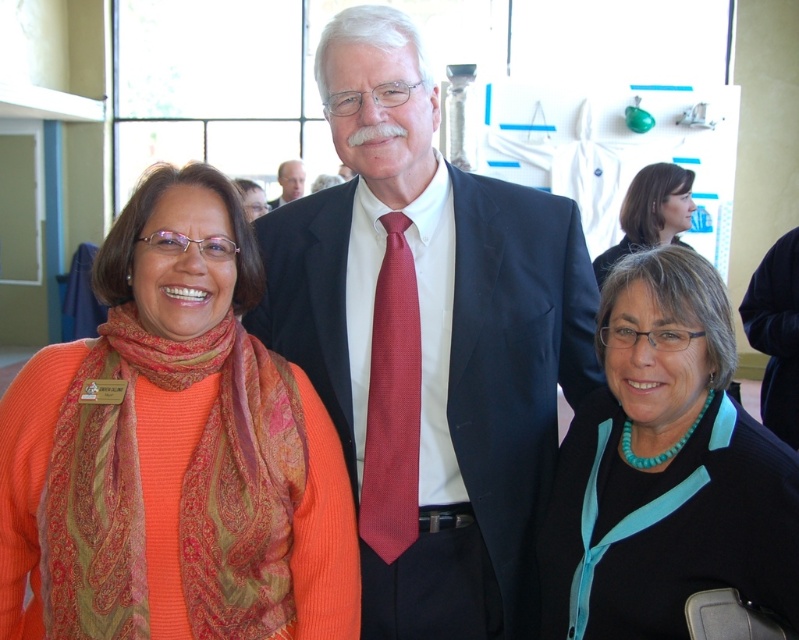
Who is taller, red textured tie at center or teal fabric blouse at upper right?

Standing taller between the two is red textured tie at center.

From the picture: Does red textured tie at center appear over teal fabric blouse at upper right?

No, red textured tie at center is not above teal fabric blouse at upper right.

Does point (374, 301) come closer to viewer compared to point (619, 225)?

Yes.

Identify the location of red textured tie at center. (392, 403).

Does matte black suit at center have a greater width compared to red textured tie at center?

Yes, matte black suit at center is wider than red textured tie at center.

How much distance is there between matte black suit at center and red textured tie at center?

matte black suit at center is 7.41 inches away from red textured tie at center.

Which is in front, point (471, 339) or point (416, 460)?

Point (416, 460) is more forward.

This screenshot has height=640, width=799. What are the coordinates of `matte black suit at center` in the screenshot? It's located at (428, 340).

Between matte black suit at center and paisley-patterned scarf at left, which one appears on the left side from the viewer's perspective?

paisley-patterned scarf at left is more to the left.

Between matte black suit at center and paisley-patterned scarf at left, which one appears on the right side from the viewer's perspective?

matte black suit at center is more to the right.

Where is `matte black suit at center`? Image resolution: width=799 pixels, height=640 pixels. matte black suit at center is located at coordinates (428, 340).